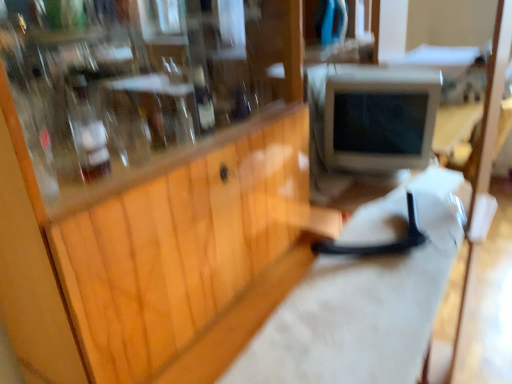
Describe the element at coordinates (380, 119) in the screenshot. The height and width of the screenshot is (384, 512). I see `white plastic computer monitor at center` at that location.

What do you see at coordinates (203, 100) in the screenshot? This screenshot has height=384, width=512. I see `translucent glass bottle at center, which is the second bottle from left to right` at bounding box center [203, 100].

The image size is (512, 384). Identify the location of wooden cabinet at center. (189, 255).

How distant is wooden cabinet at center from translucent glass bottle at upper left, the second bottle when ordered from back to front?

They are 14.36 inches apart.

Identify the location of wood on the right of translucent glass bottle at upper left, the second bottle when ordered from back to front. This screenshot has height=384, width=512. (189, 255).

How different are the orientations of wooden cabinet at center and translucent glass bottle at upper left, placed as the first bottle when sorted from front to back, in degrees?

0.283 degrees separate the facing orientations of wooden cabinet at center and translucent glass bottle at upper left, placed as the first bottle when sorted from front to back.

Can translucent glass bottle at upper left, which is counted as the first bottle, starting from the left, be found inside wooden cabinet at center?

Yes, translucent glass bottle at upper left, which is counted as the first bottle, starting from the left, is surrounded by wooden cabinet at center.

Does point (91, 164) lie behind point (201, 108)?

No.

Does translucent glass bottle at upper left, which is counted as the first bottle, starting from the left, have a greater width compared to translucent glass bottle at center, which is the second bottle from left to right?

Yes, translucent glass bottle at upper left, which is counted as the first bottle, starting from the left, is wider than translucent glass bottle at center, which is the second bottle from left to right.

Does translucent glass bottle at upper left, placed as the first bottle when sorted from front to back, have a larger size compared to translucent glass bottle at center, arranged as the first bottle when viewed from the right?

Yes, translucent glass bottle at upper left, placed as the first bottle when sorted from front to back, is bigger than translucent glass bottle at center, arranged as the first bottle when viewed from the right.

Can you confirm if translucent glass bottle at center, which is the 2th bottle in front-to-back order, is taller than wooden cabinet at center?

No.

From a real-world perspective, is translucent glass bottle at center, the first bottle when ordered from back to front, on wooden cabinet at center?

Yes.

Is translucent glass bottle at center, the first bottle when ordered from back to front, positioned behind wooden cabinet at center?

Yes, it is behind wooden cabinet at center.

Consider the image. How many degrees apart are the facing directions of white matte workbench at center and wooden cabinet at center?

3.9 degrees separate the facing orientations of white matte workbench at center and wooden cabinet at center.

Between point (448, 260) and point (219, 134), which one is positioned in front?

The point (448, 260) is closer.

Which object is positioned more to the right, white matte workbench at center or wooden cabinet at center?

white matte workbench at center is more to the right.

Is white matte workbench at center wider or thinner than wooden cabinet at center?

Considering their sizes, white matte workbench at center looks slimmer than wooden cabinet at center.

From a real-world perspective, is wooden cabinet at center physically located above or below white matte workbench at center?

wooden cabinet at center is situated higher than white matte workbench at center in the real world.

Is wooden cabinet at center shorter than white matte workbench at center?

In fact, wooden cabinet at center may be taller than white matte workbench at center.

Based on their sizes in the image, would you say wooden cabinet at center is bigger or smaller than white matte workbench at center?

In the image, wooden cabinet at center appears to be larger than white matte workbench at center.

What's the angular difference between wooden cabinet at center and white matte workbench at center's facing directions?

The angle between the facing direction of wooden cabinet at center and the facing direction of white matte workbench at center is 3.9 degrees.

Is point (69, 104) closer to camera compared to point (390, 238)?

Yes, it is.

Locate an element on the screen. The image size is (512, 384). bottle that is the 2nd object to the left of the white matte workbench at center, starting at the anchor is located at coordinates click(x=87, y=130).

Which of these two, translucent glass bottle at upper left, the 2th bottle in the right-to-left sequence, or white matte workbench at center, stands taller?

white matte workbench at center is taller.

Between translucent glass bottle at upper left, the 2th bottle in the right-to-left sequence, and white matte workbench at center, which one has smaller size?

translucent glass bottle at upper left, the 2th bottle in the right-to-left sequence, is smaller.

Considering the sizes of white plastic computer monitor at center and translucent glass bottle at upper left, the second bottle when ordered from back to front, in the image, is white plastic computer monitor at center bigger or smaller than translucent glass bottle at upper left, the second bottle when ordered from back to front,?

Clearly, white plastic computer monitor at center is larger in size than translucent glass bottle at upper left, the second bottle when ordered from back to front.

From the picture: Between white plastic computer monitor at center and translucent glass bottle at upper left, which is counted as the first bottle, starting from the left, which one appears on the left side from the viewer's perspective?

translucent glass bottle at upper left, which is counted as the first bottle, starting from the left.

At what (x,y) coordinates should I click in order to perform the action: click on computer monitor that is behind the translucent glass bottle at upper left, placed as the first bottle when sorted from front to back. Please return your answer as a coordinate pair (x, y). This screenshot has width=512, height=384. Looking at the image, I should click on 380,119.

You are a GUI agent. You are given a task and a screenshot of the screen. Output one action in this format:
    pyautogui.click(x=<x>, y=<y>)
    Task: Click on the wood on the right side of translucent glass bottle at upper left, the 2th bottle in the right-to-left sequence
    This screenshot has height=384, width=512.
    Given the screenshot: What is the action you would take?
    pyautogui.click(x=189, y=255)

Where is `bottle on the left of translucent glass bottle at center, arranged as the first bottle when viewed from the right`? The height and width of the screenshot is (384, 512). bottle on the left of translucent glass bottle at center, arranged as the first bottle when viewed from the right is located at coordinates (87, 130).

Based on their spatial positions, is translucent glass bottle at upper left, the second bottle when ordered from back to front, or translucent glass bottle at center, which is the 2th bottle in front-to-back order, closer to white plastic computer monitor at center?

translucent glass bottle at center, which is the 2th bottle in front-to-back order, is closer to white plastic computer monitor at center.

When comparing their distances from translucent glass bottle at upper left, which is counted as the first bottle, starting from the left, does white matte workbench at center or translucent glass bottle at center, the first bottle when ordered from back to front, seem further?

white matte workbench at center is positioned further to the anchor translucent glass bottle at upper left, which is counted as the first bottle, starting from the left.

Considering their positions, is translucent glass bottle at upper left, the 2th bottle in the right-to-left sequence, positioned closer to white matte workbench at center than white plastic computer monitor at center?

Among the two, white plastic computer monitor at center is located nearer to white matte workbench at center.

Considering their positions, is translucent glass bottle at center, which is the second bottle from left to right, positioned further to wooden cabinet at center than white matte workbench at center?

translucent glass bottle at center, which is the second bottle from left to right, lies further to wooden cabinet at center than the other object.

Which object lies nearer to the anchor point white plastic computer monitor at center, wooden cabinet at center or translucent glass bottle at upper left, placed as the first bottle when sorted from front to back?

The object closer to white plastic computer monitor at center is wooden cabinet at center.

Estimate the real-world distances between objects in this image. Which object is further from white plastic computer monitor at center, white matte workbench at center or translucent glass bottle at upper left, the second bottle when ordered from back to front?

translucent glass bottle at upper left, the second bottle when ordered from back to front, is further to white plastic computer monitor at center.

When comparing their distances from white plastic computer monitor at center, does translucent glass bottle at center, the first bottle when ordered from back to front, or white matte workbench at center seem closer?

white matte workbench at center is closer to white plastic computer monitor at center.

Based on their spatial positions, is white matte workbench at center or white plastic computer monitor at center further from translucent glass bottle at center, which is the second bottle from left to right?

white plastic computer monitor at center is further to translucent glass bottle at center, which is the second bottle from left to right.

Locate an element on the screen. The image size is (512, 384). wood between translucent glass bottle at upper left, which is counted as the first bottle, starting from the left, and white matte workbench at center from top to bottom is located at coordinates (189, 255).

Where is `wood between translucent glass bottle at center, which is the second bottle from left to right, and white matte workbench at center from top to bottom`? This screenshot has width=512, height=384. wood between translucent glass bottle at center, which is the second bottle from left to right, and white matte workbench at center from top to bottom is located at coordinates (189, 255).

Locate an element on the screen. The width and height of the screenshot is (512, 384). wood between translucent glass bottle at upper left, the 2th bottle in the right-to-left sequence, and white plastic computer monitor at center is located at coordinates (189, 255).

This screenshot has width=512, height=384. In order to click on bottle positioned between wooden cabinet at center and translucent glass bottle at center, which is the 2th bottle in front-to-back order, from near to far in this screenshot , I will do `click(87, 130)`.